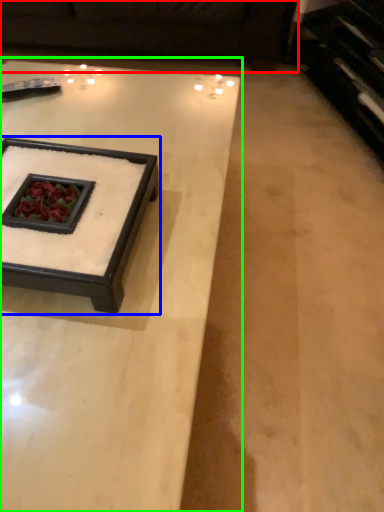
Question: Estimate the real-world distances between objects in this image. Which object is farther from couch (highlighted by a red box), coffee table (highlighted by a blue box) or coffee table (highlighted by a green box)?

Choices:
 (A) coffee table
 (B) coffee table

Answer: (A)